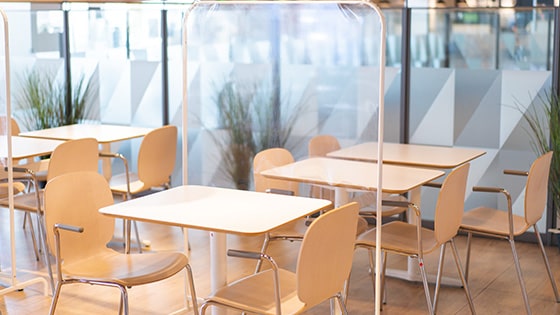
The height and width of the screenshot is (315, 560). I want to click on chairs, so click(312, 263), click(442, 210), click(532, 190), click(323, 136), click(274, 155), click(54, 190), click(60, 157), click(155, 148), click(13, 121), click(13, 181).